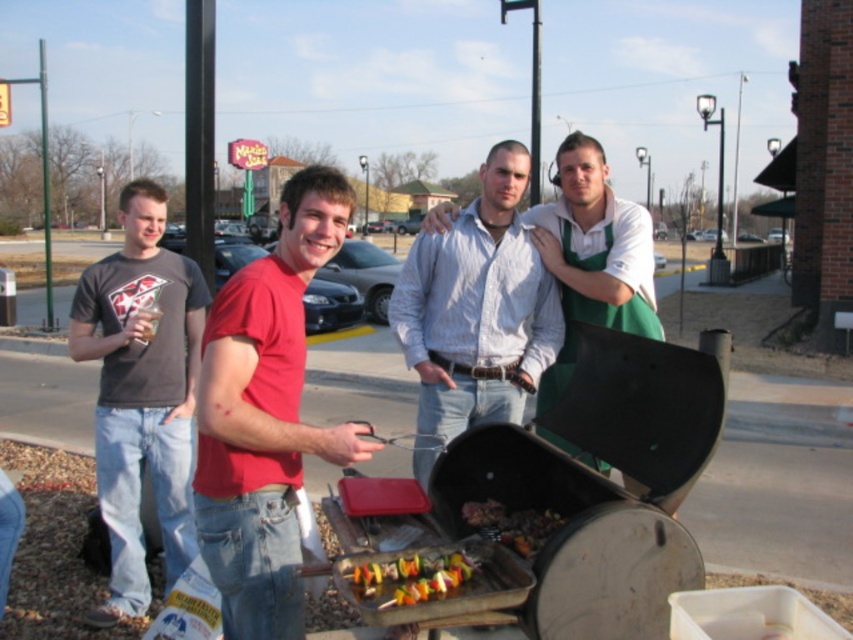
In the barbecue scene, you notice the white textured shirt at center and the grilled skewers at center. Which object takes up more space in the image?

The white textured shirt at center is bigger than the grilled skewers at center, so it takes up more space in the image.

You are standing at the point marked by coordinates point (474,310) in the image. What is the closest object to you?

The point (474,310) marks the white textured shirt at center, so the closest object to you is the white textured shirt at center.